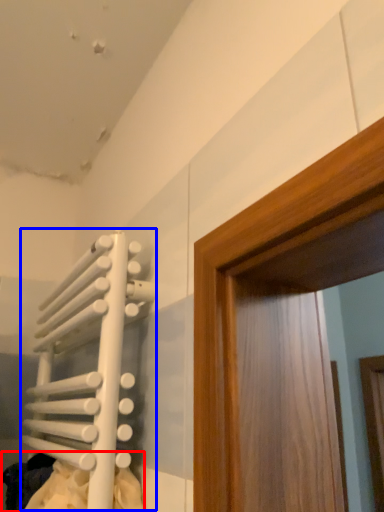
Question: Which object appears farthest to the camera in this image, laundry (highlighted by a red box) or radiator (highlighted by a blue box)?

Choices:
 (A) laundry
 (B) radiator

Answer: (A)